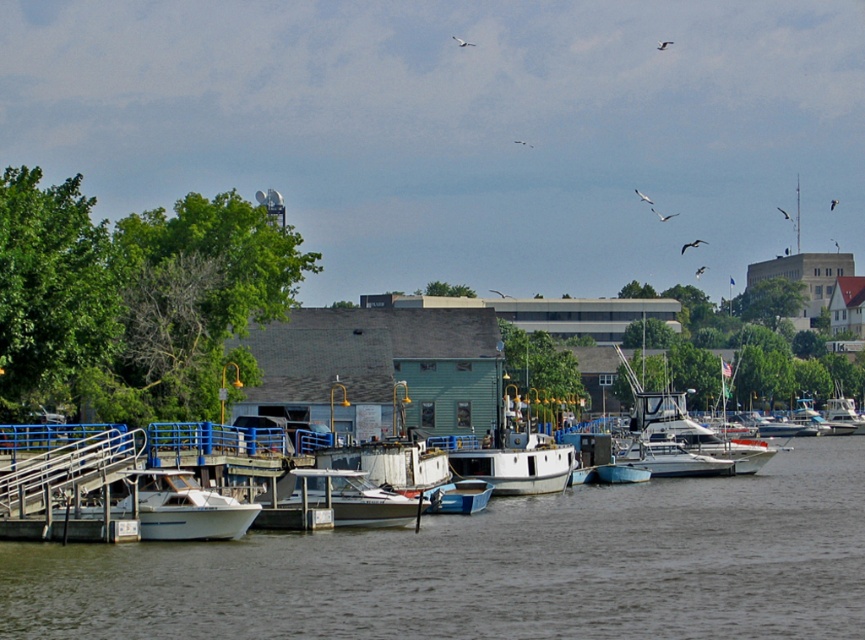
You are standing at the edge of the waterfront scene and want to take a photo that includes both the point at coordinates point (151, 484) and point (462, 497). Which point will appear larger in your photo?

Point (151, 484) is closer to the camera than point (462, 497), so it will appear larger in the photo.

From the picture: You are standing at the ramp leading up to the pier and want to walk to the point marked by point (x=692, y=566). However, there is an obstacle at point (x=331, y=499). Can you safely walk around the obstacle to reach your destination?

Point (x=692, y=566) is in front of point (x=331, y=499), so you can safely walk around the obstacle at point (x=331, y=499) to reach your destination as the target point is ahead of the obstacle.

You are a photographer planning to take a photo of the waterfront scene. You want to ensure both the white glossy boat at lower left and the metallic blue boat at center are visible in your shot. Based on their positions, which boat should you position closer to the left side of your camera frame?

The white glossy boat at lower left is positioned to the left of the metallic blue boat at center, so to capture both in the frame, you should position the white glossy boat at lower left closer to the left side of your camera frame.